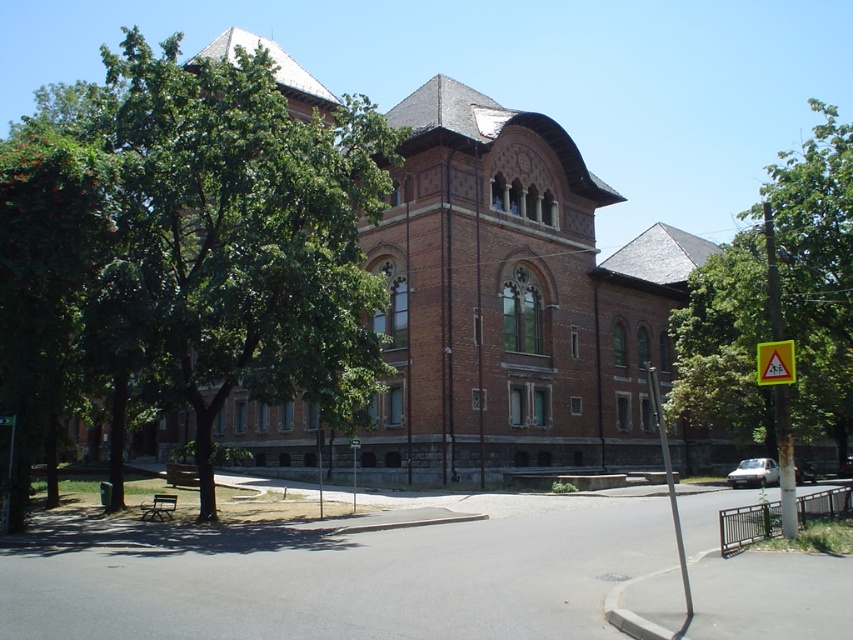
You are a visitor trying to find the entrance to the historic building. You see a yellow triangular sign at upper right and a yellow plastic sign at center. Which sign is wider?

The yellow triangular sign at upper right might be wider than yellow plastic sign at center according to the description.